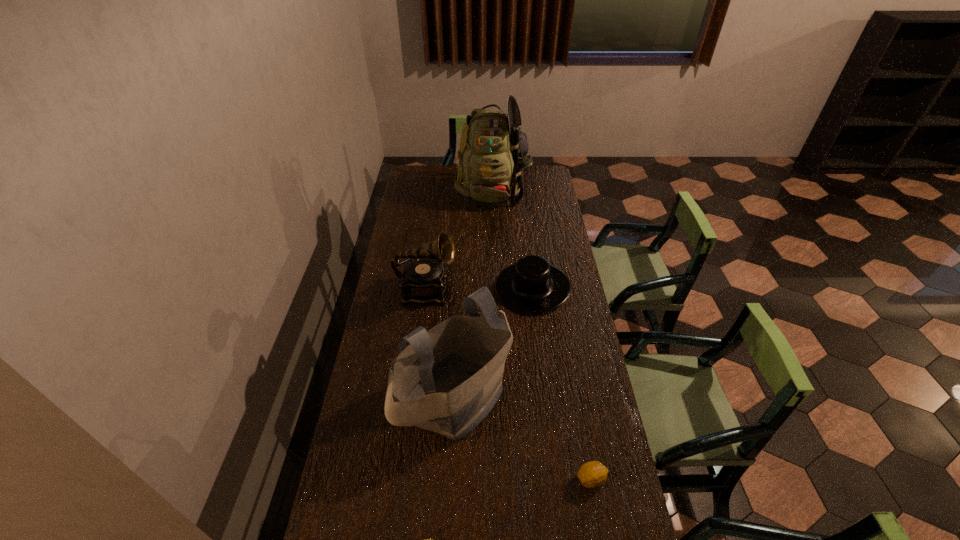
Identify the location of free space that satisfies the following two spatial constraints: 1. on the front-facing side of the farthest object; 2. on the horn of the phonograph record. (496, 291).